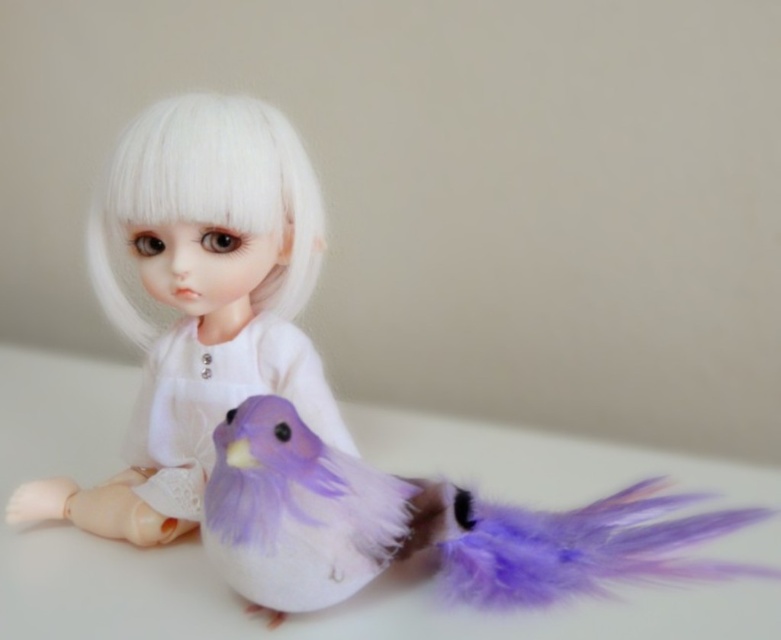
Does purple feathered bird at center appear under white silky hair at center?

Yes, purple feathered bird at center is below white silky hair at center.

Which is more to the right, purple feathered bird at center or white silky hair at center?

Positioned to the right is purple feathered bird at center.

Who is more forward, (701, 524) or (119, 248)?

Point (701, 524) is in front.

At what (x,y) coordinates should I click in order to perform the action: click on purple feathered bird at center. Please return your answer as a coordinate pair (x, y). The width and height of the screenshot is (781, 640). Looking at the image, I should click on (423, 525).

Does white matte doll at center appear under white silky hair at center?

Yes.

Which is more to the right, white matte doll at center or white silky hair at center?

From the viewer's perspective, white matte doll at center appears more on the right side.

Find the location of a particular element. Image resolution: width=781 pixels, height=640 pixels. white matte doll at center is located at coordinates (198, 300).

Between white matte doll at center and purple feathered bird at center, which one has more height?

white matte doll at center

Can you confirm if white matte doll at center is bigger than purple feathered bird at center?

Indeed, white matte doll at center has a larger size compared to purple feathered bird at center.

This screenshot has width=781, height=640. I want to click on white matte doll at center, so click(x=198, y=300).